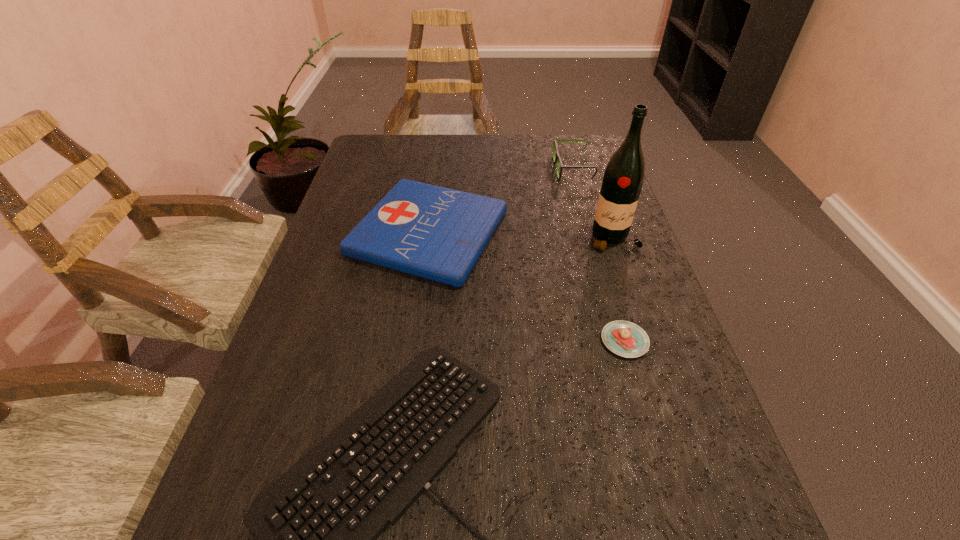
Find the location of `free space that satisfies the following two spatial constraints: 1. on the lens of the pastry; 2. on the left side of the fourth shortest object`. free space that satisfies the following two spatial constraints: 1. on the lens of the pastry; 2. on the left side of the fourth shortest object is located at coordinates (622, 341).